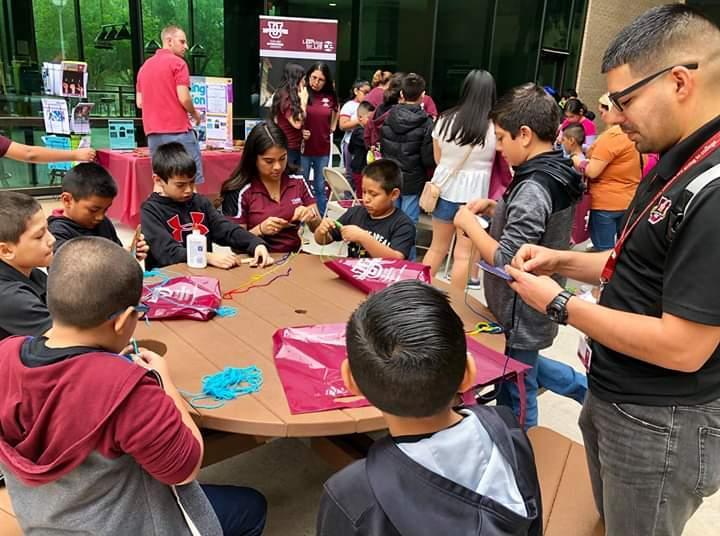
I want to click on window, so click(106, 58), click(49, 39), click(168, 11), click(209, 13), click(552, 35), click(521, 31), click(461, 26), click(376, 17), click(325, 11).